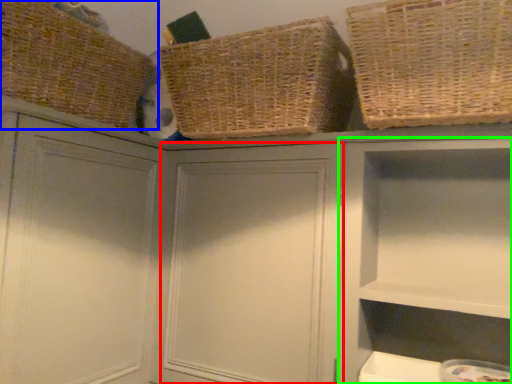
Question: Which object is the closest to the cabinet (highlighted by a red box)? Choose among these: basket (highlighted by a blue box) or cabinet (highlighted by a green box).

Choices:
 (A) basket
 (B) cabinet

Answer: (B)